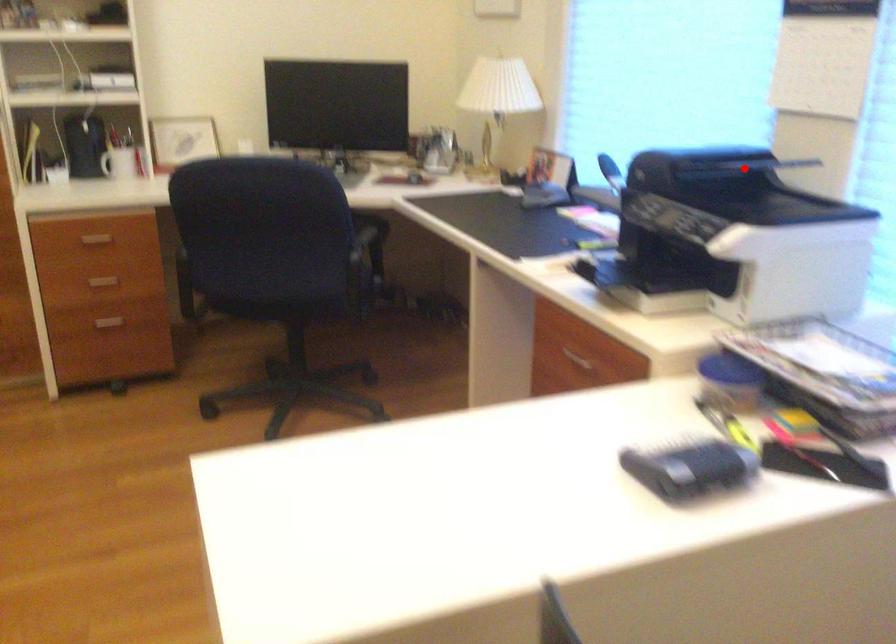
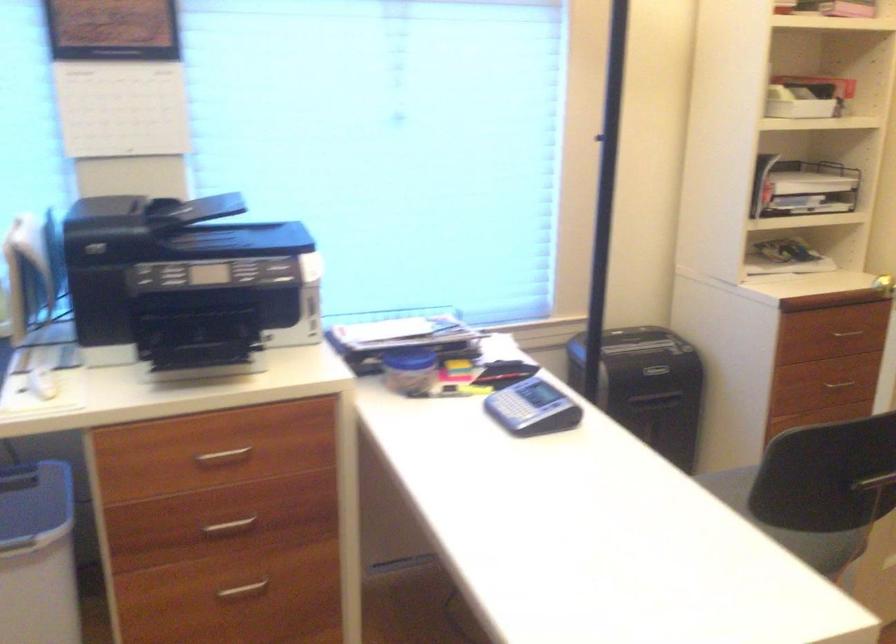
Question: A red point is marked in image1. In image2, is the corresponding 3D point closer to the camera or farther? Reply with the corresponding letter.

Choices:
 (A) The corresponding 3D point is closer.
 (B) The corresponding 3D point is farther.

Answer: (A)